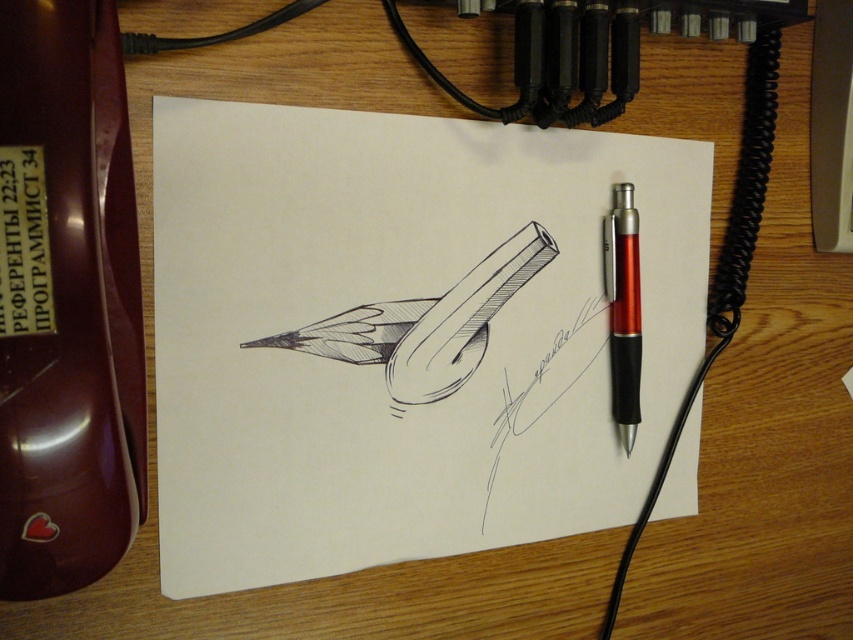
You need to place a 5 inch long ruler between the white paper at center and the translucent red pen at right. Will it fit without overlapping either object?

The distance between the white paper at center and the translucent red pen at right is 4.95 inches. Since the ruler is 5 inches long, it will not fit without overlapping because the distance is slightly shorter than the ruler.

You are an artist trying to locate your white paper at center on a desk. Based on the coordinates given, where would you find it?

The white paper at center is located at the coordinates point (401, 333).